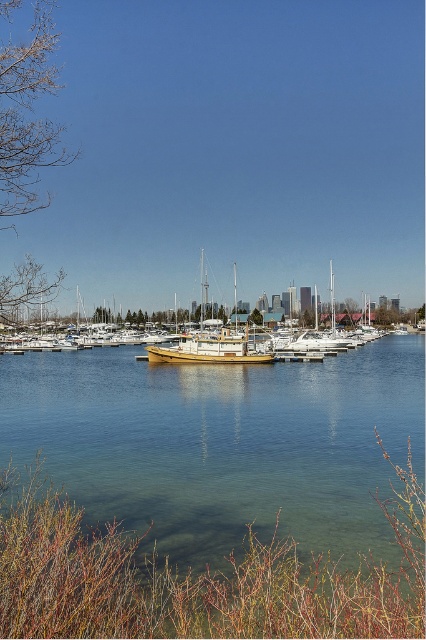
You are a photographer planning to take a photo of the wooden sailboat at center and the clear water at center. If you want to ensure both elements are fully visible in your shot, which object should you prioritize framing first?

The clear water at center has a larger width than the wooden sailboat at center, so you should prioritize framing the clear water at center first to ensure both fit in the photo.

You are standing on the wooden boat at center and want to jump into the clear water at center. Based on the water width compared to the boat, is the water wide enough for a safe jump?

The clear water at center is narrower than the wooden boat at center, so the water might not be wide enough for a safe jump as it is narrower than the boat itself.

You are standing on the shore looking at the wooden boat at center and the wooden sailboat at center. Which one appears closer to you?

The wooden boat at center appears closer because it is in front of the wooden sailboat at center.